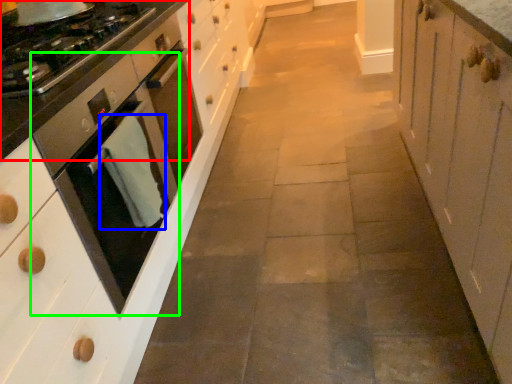
Question: Estimate the real-world distances between objects in this image. Which object is farther from countertop (highlighted by a red box), material (highlighted by a blue box) or home appliance (highlighted by a green box)?

Choices:
 (A) material
 (B) home appliance

Answer: (A)